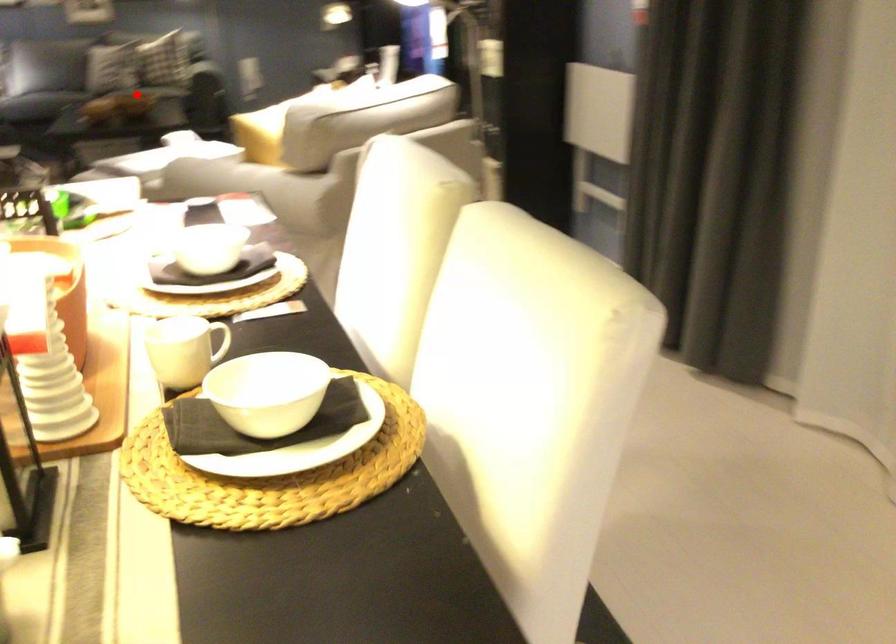
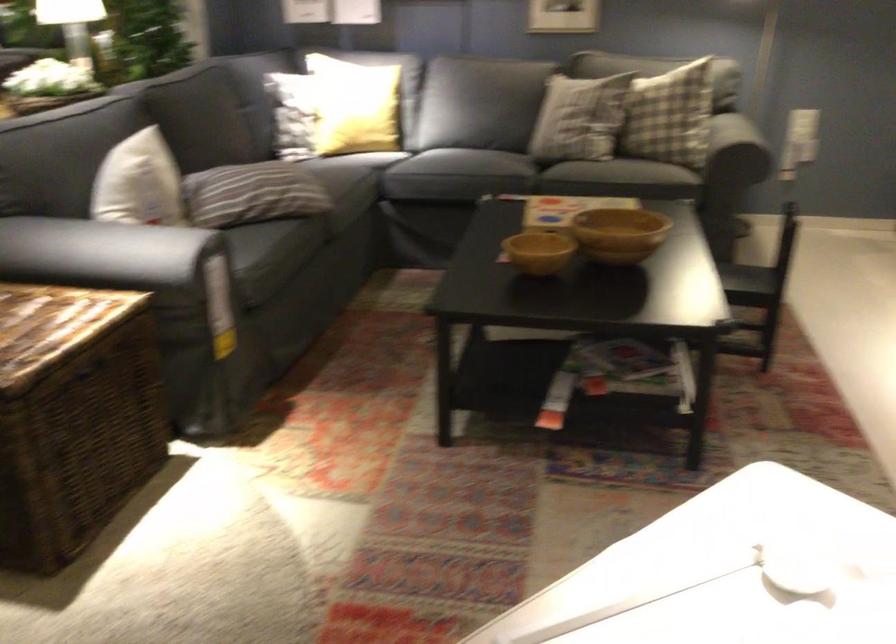
Question: I am providing you with two images of the same scene from different viewpoints. A red point is marked on the first image. At the location where the point appears in image 1, is it still visible in image 2?

Choices:
 (A) Yes
 (B) No

Answer: (A)